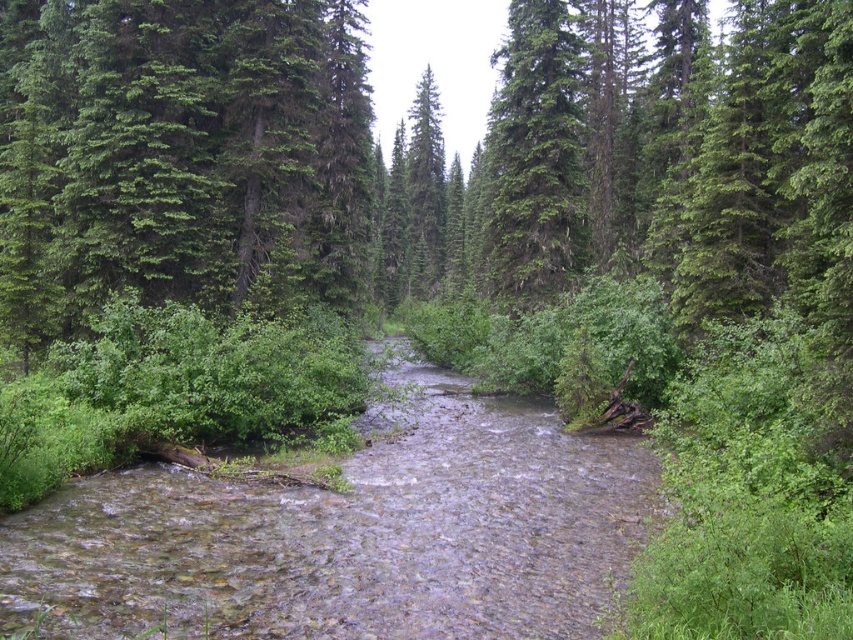
Question: Which point appears farthest from the camera in this image?

Choices:
 (A) click(485, 211)
 (B) click(593, 552)

Answer: (A)

Question: Which point appears farthest from the camera in this image?

Choices:
 (A) (502, 596)
 (B) (535, 102)

Answer: (B)

Question: Does clear water stream at center have a larger size compared to green textured tree at upper center?

Choices:
 (A) yes
 (B) no

Answer: (B)

Question: Is clear water stream at center smaller than green textured tree at upper center?

Choices:
 (A) yes
 (B) no

Answer: (A)

Question: Can you confirm if clear water stream at center is positioned above green textured tree at upper center?

Choices:
 (A) yes
 (B) no

Answer: (B)